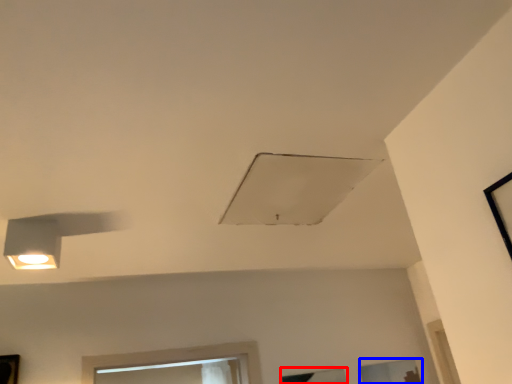
Question: Which object appears closest to the camera in this image, window (highlighted by a red box) or window (highlighted by a blue box)?

Choices:
 (A) window
 (B) window

Answer: (A)